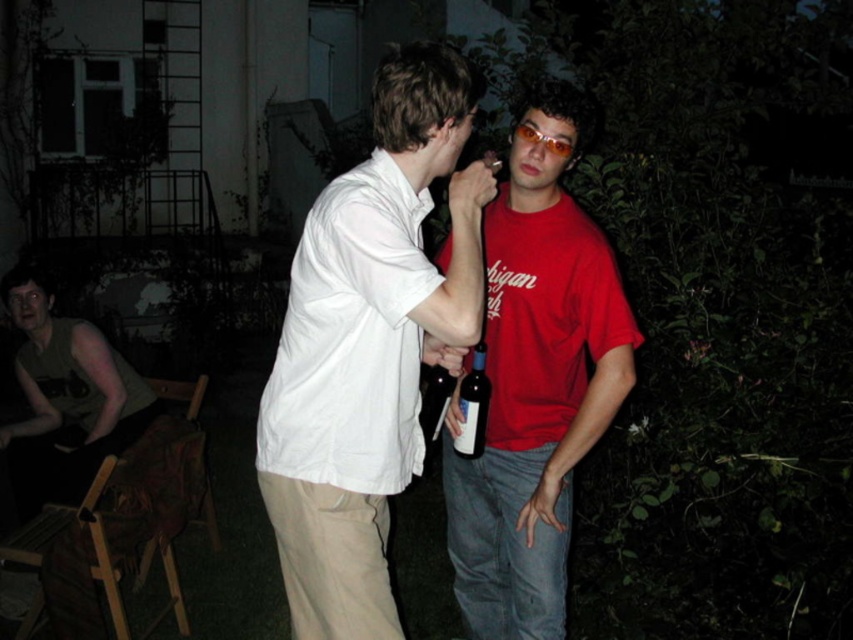
Question: Does white cotton shirt at center come behind matte green t-shirt at lower left?

Choices:
 (A) no
 (B) yes

Answer: (A)

Question: Among these objects, which one is nearest to the camera?

Choices:
 (A) dark blue glass bottle at center
 (B) matte red t-shirt at center
 (C) matte green t-shirt at lower left

Answer: (B)

Question: Which of the following is the closest to the observer?

Choices:
 (A) matte khaki pants at center
 (B) white cotton shirt at center

Answer: (B)

Question: Considering the real-world distances, which object is farthest from the matte khaki pants at center?

Choices:
 (A) white cotton shirt at center
 (B) matte green t-shirt at lower left

Answer: (B)

Question: Is matte red t-shirt at center further to camera compared to dark blue glass bottle at center?

Choices:
 (A) yes
 (B) no

Answer: (B)

Question: Is matte khaki pants at center thinner than white cotton shirt at center?

Choices:
 (A) yes
 (B) no

Answer: (B)